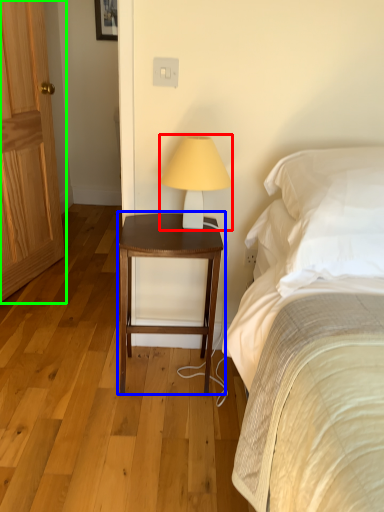
Question: Which object is positioned farthest from table lamp (highlighted by a red box)? Select from nightstand (highlighted by a blue box) and door (highlighted by a green box).

Choices:
 (A) nightstand
 (B) door

Answer: (B)